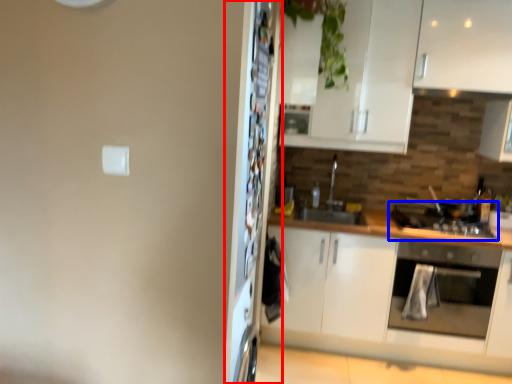
Question: Which object is further to the camera taking this photo, fridge (highlighted by a red box) or gas stove (highlighted by a blue box)?

Choices:
 (A) fridge
 (B) gas stove

Answer: (B)